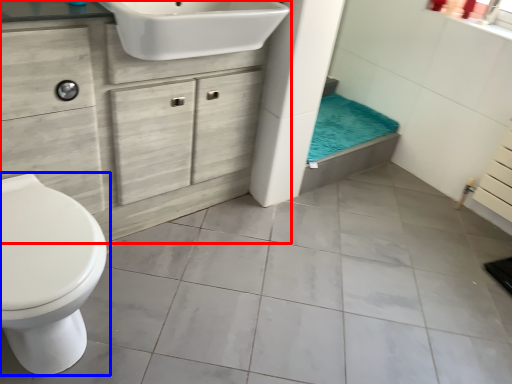
Question: Which point is further to the camera, bathroom cabinet (highlighted by a red box) or toilet (highlighted by a blue box)?

Choices:
 (A) bathroom cabinet
 (B) toilet

Answer: (A)